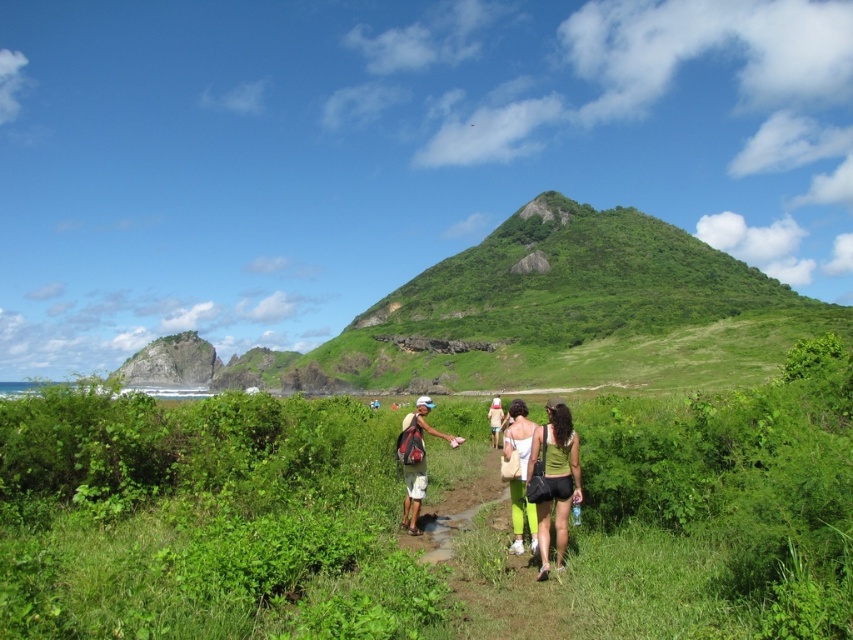
Who is positioned more to the left, green leafy vegetation at center or matte khaki shorts at center?

From the viewer's perspective, matte khaki shorts at center appears more on the left side.

Is point (682, 620) in front of point (422, 419)?

Yes, point (682, 620) is in front of point (422, 419).

Locate an element on the screen. green leafy vegetation at center is located at coordinates (206, 520).

Is green grassy hill at upper center below matte green pants at center?

Incorrect, green grassy hill at upper center is not positioned below matte green pants at center.

Is green grassy hill at upper center to the left of matte green pants at center from the viewer's perspective?

Correct, you'll find green grassy hill at upper center to the left of matte green pants at center.

Describe the element at coordinates (560, 314) in the screenshot. I see `green grassy hill at upper center` at that location.

At what (x,y) coordinates should I click in order to perform the action: click on green grassy hill at upper center. Please return your answer as a coordinate pair (x, y). This screenshot has height=640, width=853. Looking at the image, I should click on (560, 314).

Looking at this image, does green grassy hill at upper center lie in front of matte khaki shorts at center?

No.

Is green grassy hill at upper center taller than matte khaki shorts at center?

Yes.

This screenshot has height=640, width=853. I want to click on green grassy hill at upper center, so click(x=560, y=314).

Locate an element on the screen. This screenshot has width=853, height=640. green grassy hill at upper center is located at coordinates (560, 314).